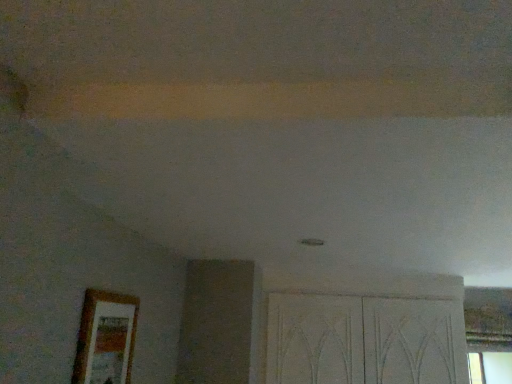
In order to face white textured screen door at lower right, should I rotate leftwards or rightwards?

A 13.132 degree turn to the right will do.

Locate an element on the screen. This screenshot has width=512, height=384. white textured screen door at lower right is located at coordinates (367, 333).

What do you see at coordinates (367, 333) in the screenshot? The height and width of the screenshot is (384, 512). I see `white textured screen door at lower right` at bounding box center [367, 333].

In order to click on wooden picture frame at lower left in this screenshot , I will do `click(106, 338)`.

This screenshot has width=512, height=384. What do you see at coordinates (106, 338) in the screenshot? I see `wooden picture frame at lower left` at bounding box center [106, 338].

Locate an element on the screen. This screenshot has height=384, width=512. white textured screen door at lower right is located at coordinates (367, 333).

Which object is positioned more to the right, white textured screen door at lower right or wooden picture frame at lower left?

white textured screen door at lower right is more to the right.

Who is more distant, white textured screen door at lower right or wooden picture frame at lower left?

white textured screen door at lower right is further away from the camera.

Does point (290, 331) appear closer or farther from the camera than point (97, 360)?

Point (290, 331) is positioned farther from the camera compared to point (97, 360).

From the image's perspective, which one is positioned lower, white textured screen door at lower right or wooden picture frame at lower left?

white textured screen door at lower right.

From a real-world perspective, is white textured screen door at lower right above or below wooden picture frame at lower left?

white textured screen door at lower right is above wooden picture frame at lower left.

Does white textured screen door at lower right have a lesser width compared to wooden picture frame at lower left?

In fact, white textured screen door at lower right might be wider than wooden picture frame at lower left.

Who is shorter, white textured screen door at lower right or wooden picture frame at lower left?

With less height is wooden picture frame at lower left.

From the picture: Which of these two, white textured screen door at lower right or wooden picture frame at lower left, is bigger?

white textured screen door at lower right is bigger.

Is white textured screen door at lower right not within wooden picture frame at lower left?

Yes.

From the picture: Is white textured screen door at lower right beside wooden picture frame at lower left?

No, white textured screen door at lower right is not touching wooden picture frame at lower left.

Does white textured screen door at lower right turn towards wooden picture frame at lower left?

Yes, white textured screen door at lower right is oriented towards wooden picture frame at lower left.

Locate an element on the screen. This screenshot has width=512, height=384. screen door below the wooden picture frame at lower left (from the image's perspective) is located at coordinates (367, 333).

Is wooden picture frame at lower left to the right of white textured screen door at lower right from the viewer's perspective?

No, wooden picture frame at lower left is not to the right of white textured screen door at lower right.

Between wooden picture frame at lower left and white textured screen door at lower right, which one is positioned in front?

Positioned in front is wooden picture frame at lower left.

Considering the positions of points (97, 346) and (337, 320), is point (97, 346) closer to camera compared to point (337, 320)?

Yes, it is in front of point (337, 320).

Looking at this image, from the image's perspective, which one is positioned lower, wooden picture frame at lower left or white textured screen door at lower right?

white textured screen door at lower right.

From a real-world perspective, which object rests below the other?

wooden picture frame at lower left.

Does wooden picture frame at lower left have a lesser width compared to white textured screen door at lower right?

Yes.

In the scene shown: Is wooden picture frame at lower left shorter than white textured screen door at lower right?

Indeed, wooden picture frame at lower left has a lesser height compared to white textured screen door at lower right.

Who is bigger, wooden picture frame at lower left or white textured screen door at lower right?

With larger size is white textured screen door at lower right.

Would you say wooden picture frame at lower left is outside white textured screen door at lower right?

Indeed, wooden picture frame at lower left is completely outside white textured screen door at lower right.

Would you say wooden picture frame at lower left is a long distance from white textured screen door at lower right?

wooden picture frame at lower left is far away from white textured screen door at lower right.

Is white textured screen door at lower right at the back of wooden picture frame at lower left?

No, wooden picture frame at lower left is not facing the opposite direction of white textured screen door at lower right.

How many degrees apart are the facing directions of wooden picture frame at lower left and white textured screen door at lower right?

There is a 90.1-degree angle between the facing directions of wooden picture frame at lower left and white textured screen door at lower right.

Where is `screen door behind the wooden picture frame at lower left`? screen door behind the wooden picture frame at lower left is located at coordinates (367, 333).

There is a wooden picture frame at lower left. In order to click on screen door above it (from a real-world perspective) in this screenshot , I will do `click(367, 333)`.

Image resolution: width=512 pixels, height=384 pixels. Identify the location of screen door behind the wooden picture frame at lower left. (367, 333).